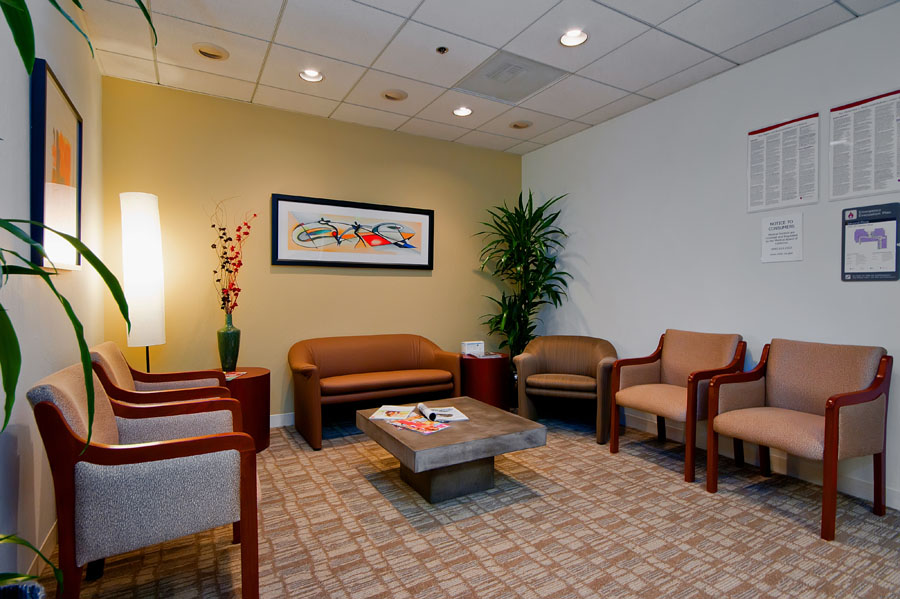
The height and width of the screenshot is (599, 900). What are the coordinates of `vase` in the screenshot? It's located at (226, 347).